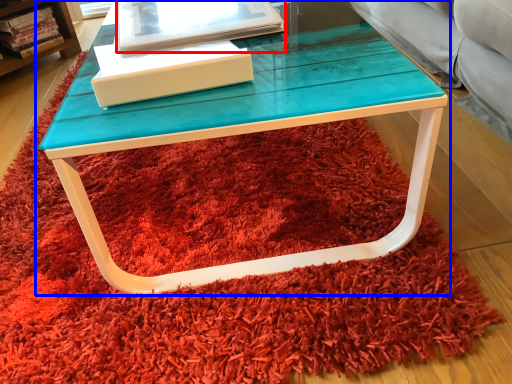
Question: Which point is further to the camera, book (highlighted by a red box) or table (highlighted by a blue box)?

Choices:
 (A) book
 (B) table

Answer: (A)